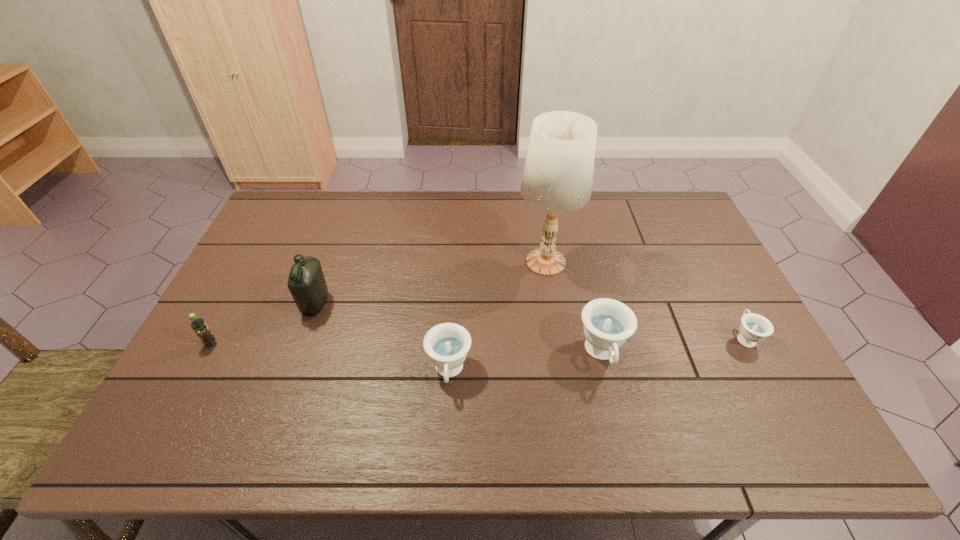
At what (x,y) coordinates should I click in order to perform the action: click on vacant region between the soda and the shortest teacup. Please return your answer as a coordinate pair (x, y). Image resolution: width=960 pixels, height=540 pixels. Looking at the image, I should click on (478, 341).

Locate which object is the fifth closest to the second teacup from left to right. Please provide its 2D coordinates. Your answer should be formatted as a tuple, i.e. [(x, y)], where the tuple contains the x and y coordinates of a point satisfying the conditions above.

[(198, 324)]

Locate an element on the screen. The image size is (960, 540). object that is the closest to the second teacup from right to left is located at coordinates (558, 174).

In order to click on teacup that is the second closest to the tallest object in this screenshot , I will do point(447,344).

The image size is (960, 540). Identify the location of teacup that is the second closest to the second farthest object. (608, 323).